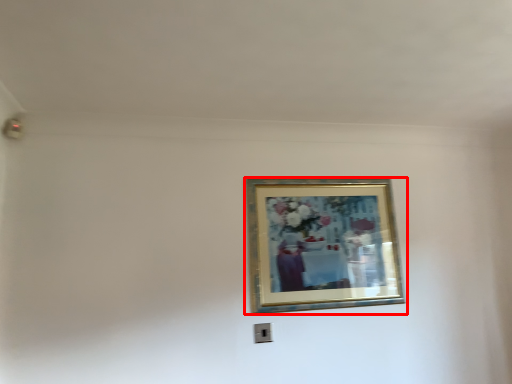
Question: From the image's perspective, considering the relative positions of picture frame (annotated by the red box) and electric outlet in the image provided, where is picture frame (annotated by the red box) located with respect to the staircase?

Choices:
 (A) above
 (B) below

Answer: (A)